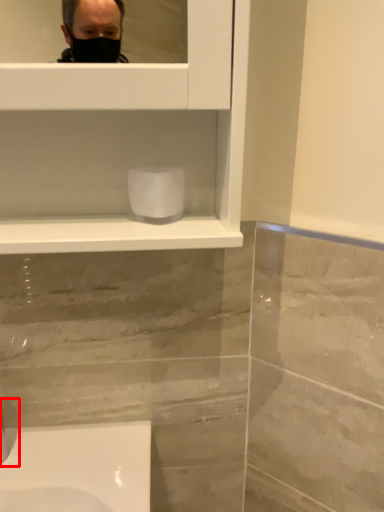
Question: From the image's perspective, considering the relative positions of faucet (annotated by the red box) and toilet paper in the image provided, where is faucet (annotated by the red box) located with respect to the staircase?

Choices:
 (A) above
 (B) below

Answer: (B)